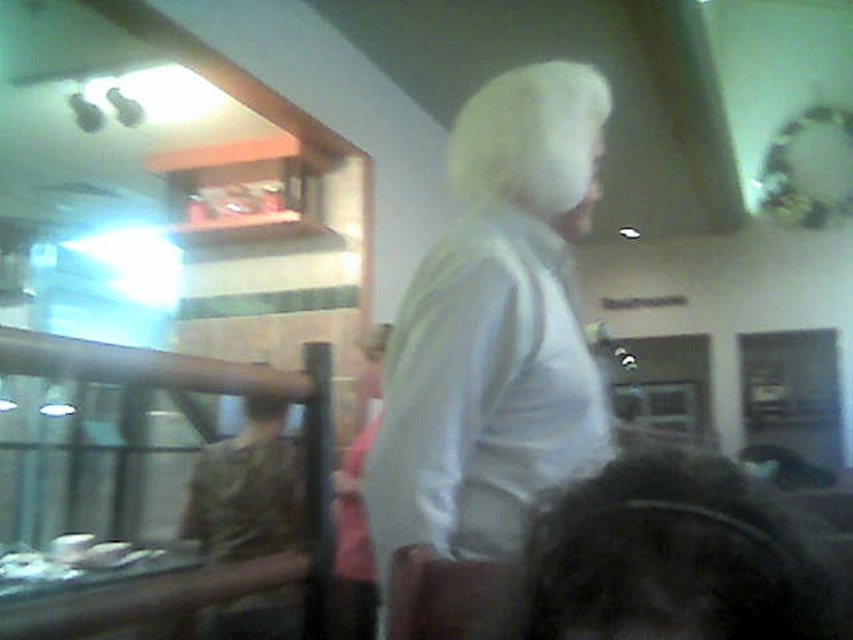
In the scene shown: Between white matte hair at upper center and camouflage fabric shirt at left, which one has more height?

camouflage fabric shirt at left is taller.

Which of these two, white matte hair at upper center or camouflage fabric shirt at left, stands shorter?

Standing shorter between the two is white matte hair at upper center.

Between point (593, 81) and point (258, 605), which one is positioned in front?

Point (593, 81) is in front.

Locate an element on the screen. This screenshot has width=853, height=640. white matte hair at upper center is located at coordinates (531, 136).

Between dark curly hair at lower right and camouflage fabric shirt at left, which one is positioned lower?

camouflage fabric shirt at left is below.

Between dark curly hair at lower right and camouflage fabric shirt at left, which one has more height?

camouflage fabric shirt at left is taller.

What do you see at coordinates (677, 557) in the screenshot? This screenshot has height=640, width=853. I see `dark curly hair at lower right` at bounding box center [677, 557].

Where is `dark curly hair at lower right`? The image size is (853, 640). dark curly hair at lower right is located at coordinates (677, 557).

How much distance is there between white matte jacket at center and dark curly hair at lower right?

white matte jacket at center is 14.89 inches from dark curly hair at lower right.

Is white matte jacket at center above dark curly hair at lower right?

Indeed, white matte jacket at center is positioned over dark curly hair at lower right.

Is point (503, 516) less distant than point (660, 556)?

No, (503, 516) is further to viewer.

Find the location of a particular element. This screenshot has width=853, height=640. white matte jacket at center is located at coordinates (494, 330).